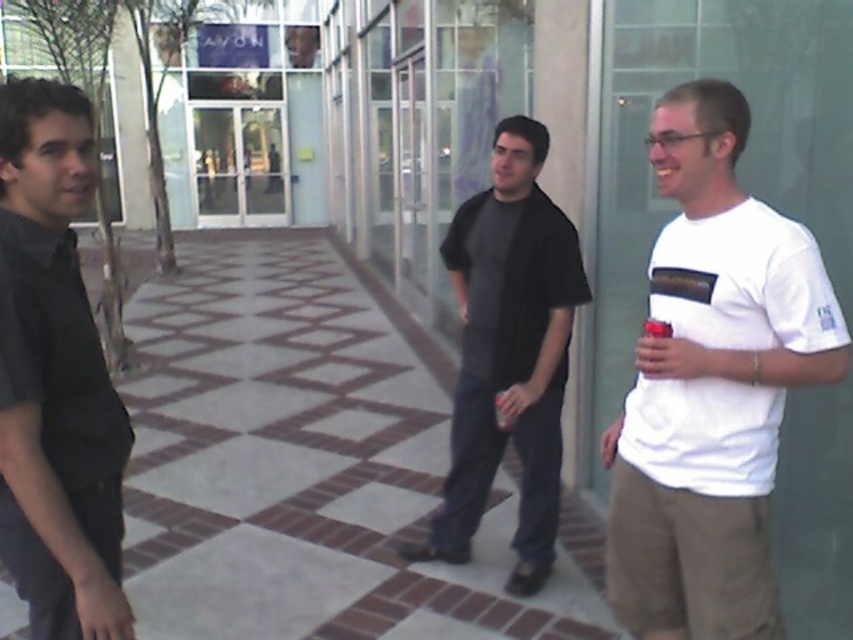
You are standing at the entrance of the AVON store and want to walk to the checkerboard tile pavement at center. According to the coordinates provided, in which direction should you move relative to the store entrance?

The checkerboard tile pavement at center is located at coordinates point (x=303, y=465). Since the store entrance is likely near the AVON signage on the building, you should move towards the center area of the walkway to reach the checkerboard tile pavement at center.